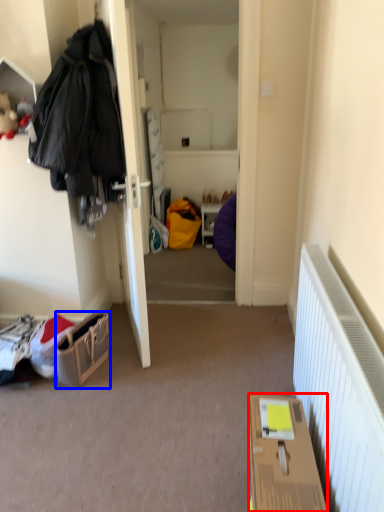
Question: Among these objects, which one is nearest to the camera, box (highlighted by a red box) or handbag (highlighted by a blue box)?

Choices:
 (A) box
 (B) handbag

Answer: (A)